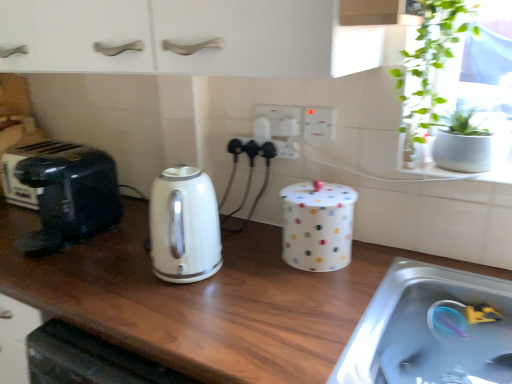
Question: Is point (317, 117) closer or farther from the camera than point (335, 231)?

Choices:
 (A) closer
 (B) farther

Answer: (B)

Question: Considering their positions, is white plastic electrical outlet at center, the third electric outlet positioned from the left, located in front of or behind white polka dot container at center, marked as the second appliance in a back-to-front arrangement?

Choices:
 (A) front
 (B) behind

Answer: (B)

Question: Estimate the real-world distances between objects in this image. Which object is farther from the white plastic electrical outlet at center, the 1th electric outlet viewed from the right?

Choices:
 (A) white glossy electric kettle at center
 (B) black plastic toaster at left, which appears as the second appliance when viewed from the right
 (C) white plastic electrical outlet at center, placed as the third electric outlet when sorted from right to left
 (D) black plastic toaster at left
 (E) wooden at center

Answer: (B)

Question: Considering the real-world distances, which object is closest to the white plastic electric outlet at center, which is the 2th electric outlet in right-to-left order?

Choices:
 (A) black plastic toaster at left, which ranks as the 1th appliance in back-to-front order
 (B) white plastic electrical outlet at center, which ranks as the first electric outlet in left-to-right order
 (C) white plastic electrical outlet at center, the third electric outlet positioned from the left
 (D) black plastic toaster at left
 (E) green leafy plant at upper right

Answer: (B)